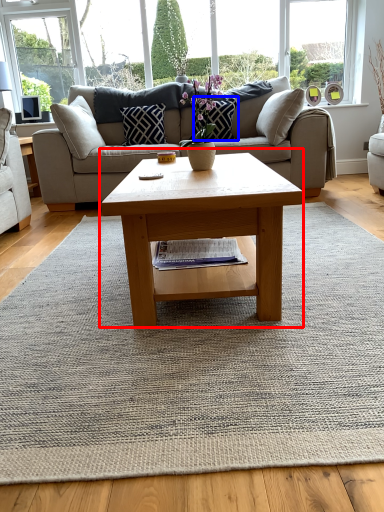
Question: Which object appears closest to the camera in this image, coffee table (highlighted by a red box) or pillow (highlighted by a blue box)?

Choices:
 (A) coffee table
 (B) pillow

Answer: (A)